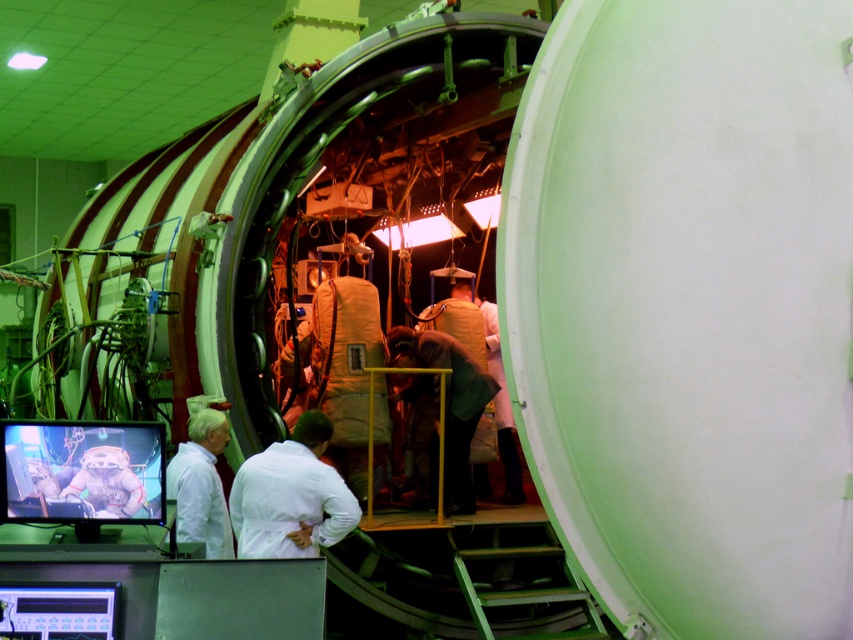
You are an engineer in the space simulation facility. You need to inspect two points marked on the cylindrical structure. The first point is at coordinates point [252,528] and the second is at point [444,406]. Which point should you check first if you want to start with the one closer to your current position?

You should check point [252,528] first because it is closer to your current position than point [444,406].

From the picture: You are a new technician in the space simulation facility. Your supervisor asks you to locate the white matte lab coat at center. According to the coordinates provided, where exactly should you look to find it?

The white matte lab coat at center is located at point (291, 497).